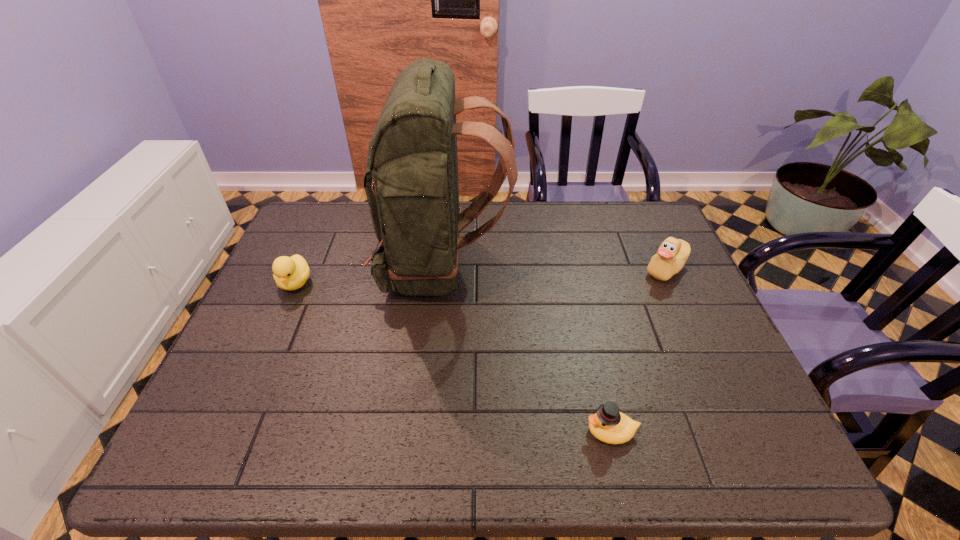
I want to click on blank region between the second tallest duck and the rightmost duck, so click(x=481, y=276).

Locate an element on the screen. vacant area that lies between the rightmost duck and the leftmost object is located at coordinates (481, 276).

Where is `vacant region between the rightmost duck and the second shortest object`? vacant region between the rightmost duck and the second shortest object is located at coordinates (481, 276).

Where is `vacant area that lies between the third object from left to right and the rightmost object`? This screenshot has width=960, height=540. vacant area that lies between the third object from left to right and the rightmost object is located at coordinates (638, 350).

This screenshot has height=540, width=960. In order to click on vacant region between the second duck from left to right and the leftmost object in this screenshot , I will do `click(453, 357)`.

Locate an element on the screen. The image size is (960, 540). the third closest object relative to the shortest duck is located at coordinates (290, 273).

Locate an element on the screen. This screenshot has height=540, width=960. object that is the third closest to the shortest object is located at coordinates (290, 273).

What are the coordinates of `duck that is the second closest to the rightmost object` in the screenshot? It's located at (290, 273).

Point out which duck is positioned as the second nearest to the nearest duck. Please provide its 2D coordinates. Your answer should be formatted as a tuple, i.e. [(x, y)], where the tuple contains the x and y coordinates of a point satisfying the conditions above.

[(290, 273)]

This screenshot has width=960, height=540. Identify the location of vacant space that satisfies the following two spatial constraints: 1. at the beak of the rightmost duck; 2. on the front-facing side of the leftmost duck. (672, 283).